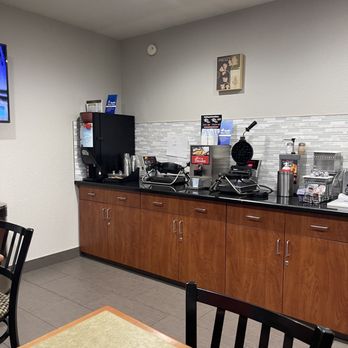
The width and height of the screenshot is (348, 348). Find the location of `waffle maker`. waffle maker is located at coordinates (167, 167), (236, 169).